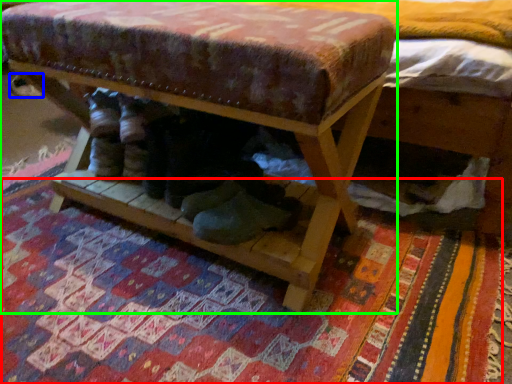
Question: Which is nearer to the mat (highlighted by a red box)? shoe (highlighted by a blue box) or furniture (highlighted by a green box).

Choices:
 (A) shoe
 (B) furniture

Answer: (B)